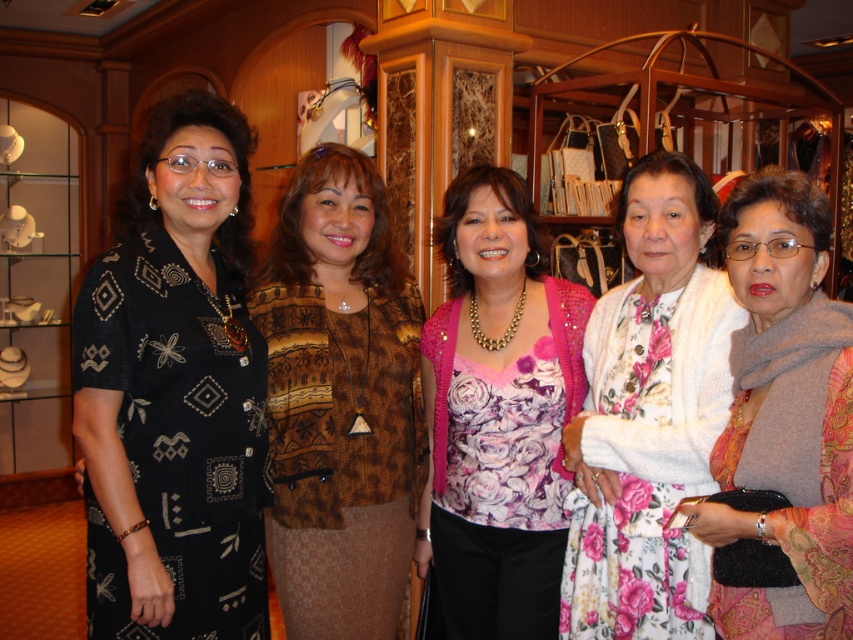
Based on the scene description, where is the pink floral blouse at center located in terms of coordinates?

The pink floral blouse at center is located at coordinates point (497, 413).

You are standing at the point (x=219, y=451) and want to reach the door located at the opposite side of the room. There is a clearance of 1.6 meters between you and the nearest obstacle. Can you safely walk through this path?

The clearance between you and the nearest obstacle is 1.6 meters, which is slightly less than your required 1.68 meters. Therefore, it might be risky to proceed as there is insufficient space.